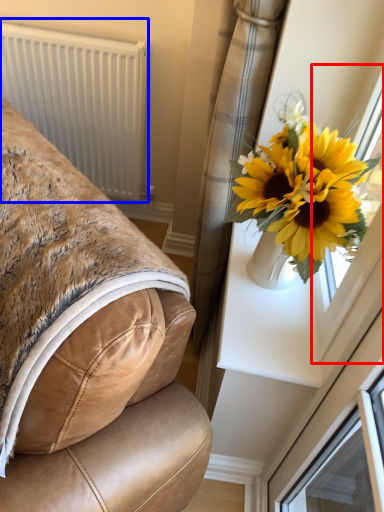
Question: Which of the following is the closest to the observer, window frame (highlighted by a red box) or radiator (highlighted by a blue box)?

Choices:
 (A) window frame
 (B) radiator

Answer: (A)